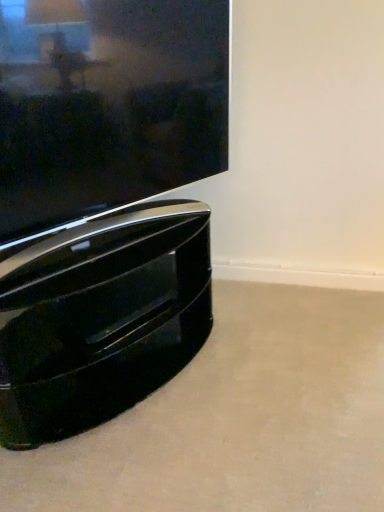
Question: Considering the positions of glossy black tv at lower left and glossy black tv stand at lower left in the image, is glossy black tv at lower left bigger or smaller than glossy black tv stand at lower left?

Choices:
 (A) big
 (B) small

Answer: (B)

Question: From a real-world perspective, relative to glossy black tv stand at lower left, is glossy black tv at lower left vertically above or below?

Choices:
 (A) below
 (B) above

Answer: (B)

Question: Would you say glossy black tv at lower left is inside or outside glossy black tv stand at lower left?

Choices:
 (A) outside
 (B) inside

Answer: (A)

Question: In the image, is glossy black tv stand at lower left positioned in front of or behind glossy black tv at lower left?

Choices:
 (A) behind
 (B) front

Answer: (A)

Question: Does point (122, 212) appear closer or farther from the camera than point (125, 172)?

Choices:
 (A) farther
 (B) closer

Answer: (A)

Question: Considering the relative positions of glossy black tv stand at lower left and glossy black tv at lower left in the image provided, is glossy black tv stand at lower left to the left or to the right of glossy black tv at lower left?

Choices:
 (A) left
 (B) right

Answer: (A)

Question: From the image's perspective, relative to glossy black tv at lower left, is glossy black tv stand at lower left above or below?

Choices:
 (A) below
 (B) above

Answer: (A)